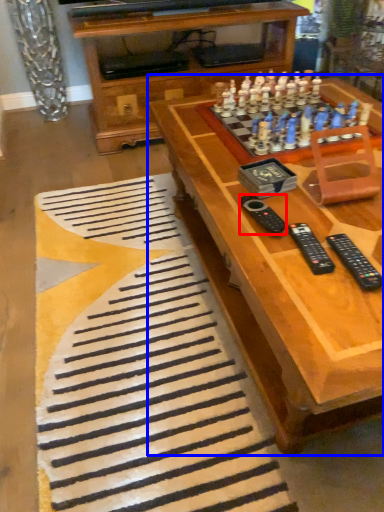
Question: Which point is further to the camera, remote (highlighted by a red box) or table (highlighted by a blue box)?

Choices:
 (A) remote
 (B) table

Answer: (A)